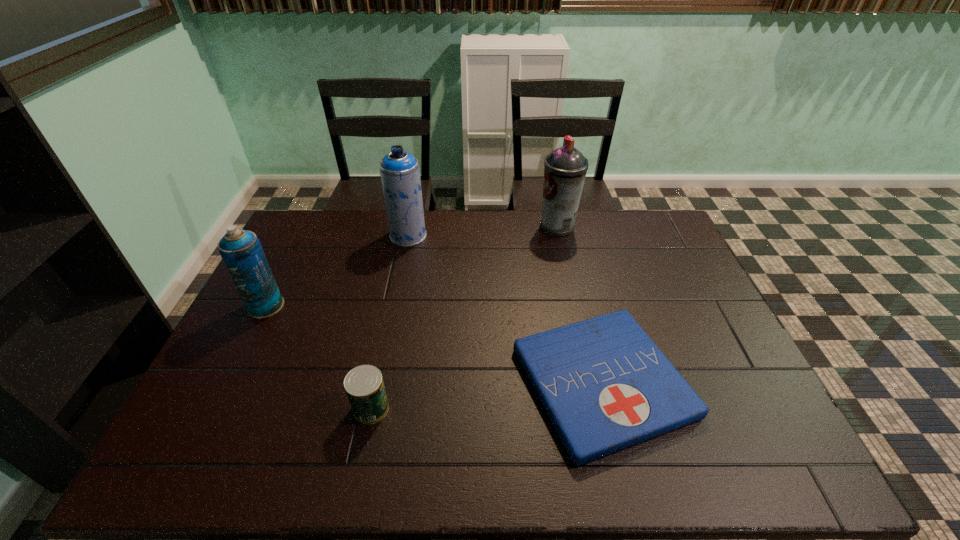
Find the location of `free area in between the first-aid kit and the third tallest object`. free area in between the first-aid kit and the third tallest object is located at coordinates (434, 344).

You are a GUI agent. You are given a task and a screenshot of the screen. Output one action in this format:
    pyautogui.click(x=<x>, y=<y>)
    Task: Click on the object that is the closest to the rightmost aerosol can
    
    Given the screenshot: What is the action you would take?
    pyautogui.click(x=605, y=385)

Locate an element on the screen. the fourth closest object to the second shortest object is located at coordinates (565, 169).

Where is `aerosol can that is the closest one to the rightmost aerosol can`? This screenshot has height=540, width=960. aerosol can that is the closest one to the rightmost aerosol can is located at coordinates (400, 175).

You are a GUI agent. You are given a task and a screenshot of the screen. Output one action in this format:
    pyautogui.click(x=<x>, y=<y>)
    Task: Click on the aerosol can that is the second nearest to the leftmost aerosol can
    This screenshot has height=540, width=960.
    Given the screenshot: What is the action you would take?
    pyautogui.click(x=565, y=169)

Where is `vacant region that satisfies the following two spatial constraints: 1. on the front side of the third tallest object; 2. on the left side of the second shortest object`? This screenshot has height=540, width=960. vacant region that satisfies the following two spatial constraints: 1. on the front side of the third tallest object; 2. on the left side of the second shortest object is located at coordinates (215, 408).

The height and width of the screenshot is (540, 960). Identify the location of vacant point that satisfies the following two spatial constraints: 1. on the back side of the can; 2. on the right side of the first-aid kit. (376, 382).

Where is `vacant area that satisfies the following two spatial constraints: 1. on the back side of the second aerosol can from right to left; 2. on the left side of the rightmost aerosol can`? This screenshot has width=960, height=540. vacant area that satisfies the following two spatial constraints: 1. on the back side of the second aerosol can from right to left; 2. on the left side of the rightmost aerosol can is located at coordinates (410, 226).

The image size is (960, 540). Identify the location of free space in the image that satisfies the following two spatial constraints: 1. on the back side of the rightmost aerosol can; 2. on the left side of the second aerosol can from left to right. (410, 226).

In order to click on vacant region that satisfies the following two spatial constraints: 1. on the back side of the rightmost aerosol can; 2. on the right side of the second shortest object in this screenshot , I will do `click(409, 226)`.